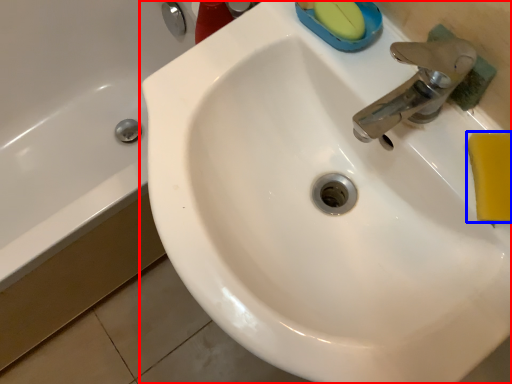
Question: Which point is further to the camera, sink (highlighted by a red box) or soap (highlighted by a blue box)?

Choices:
 (A) sink
 (B) soap

Answer: (A)